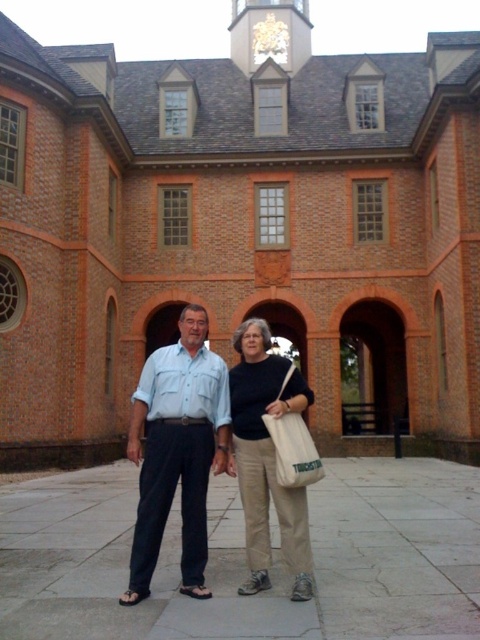
You are a photographer trying to capture a clear shot of the beige cotton pants at center without the light blue denim shirt at center blocking it. What should you do?

The light blue denim shirt at center is in front of the beige cotton pants at center. To capture a clear shot of the beige cotton pants at center without obstruction, you should adjust the position of the light blue denim shirt at center so it is no longer blocking the view of the beige cotton pants at center.

You are a photographer standing 2 meters away from the beige cotton pants at center and white canvas bag at center. You want to take a photo that includes both items without moving them. Can you fit both items into the frame of your camera, which has a maximum width of 1.5 meters?

The beige cotton pants at center is 1.03 meters from the white canvas bag at center. Since the distance between them is less than the camera frame width of 1.5 meters, you can fit both items into the frame.